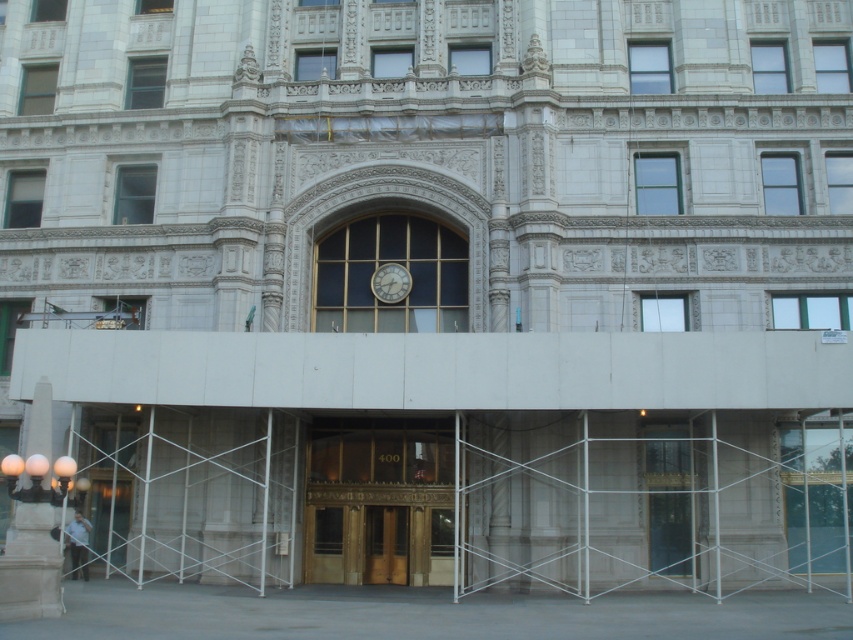
Question: Can you confirm if white marble column at lower left is wider than white glossy clock at center?

Choices:
 (A) yes
 (B) no

Answer: (A)

Question: Where is white marble column at lower left located in relation to wooden door at center in the image?

Choices:
 (A) above
 (B) below

Answer: (A)

Question: Which object appears closest to the camera in this image?

Choices:
 (A) wooden door at center
 (B) gold/golden/bronze door at center
 (C) white glossy clock at center

Answer: (B)

Question: Can you confirm if white marble column at lower left is positioned above white glossy clock at center?

Choices:
 (A) no
 (B) yes

Answer: (A)

Question: Based on their relative distances, which object is nearer to the white glossy clock at center?

Choices:
 (A) gold/golden/bronze door at center
 (B) white marble column at lower left

Answer: (A)

Question: Among these points, which one is farthest from the camera?

Choices:
 (A) (369, 508)
 (B) (451, 554)

Answer: (A)